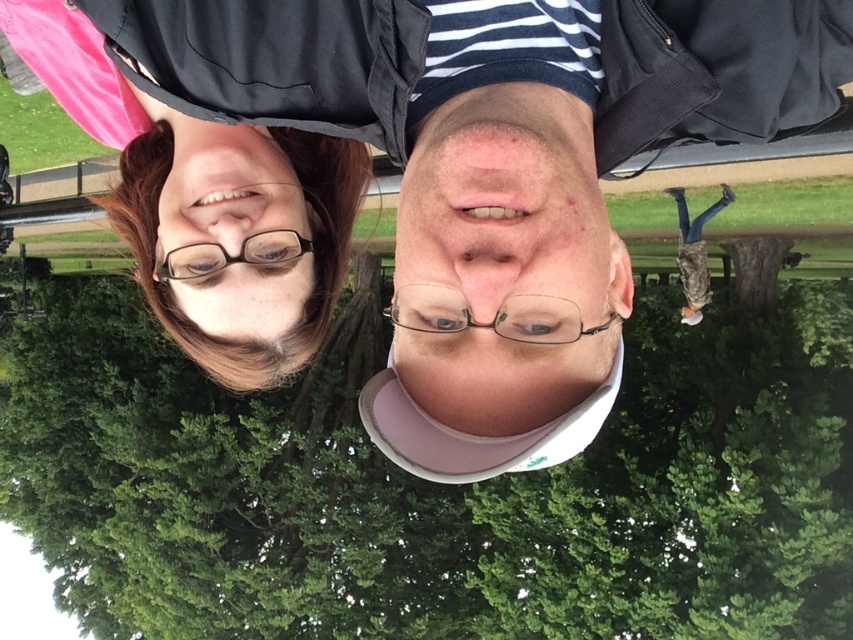
Is smooth skin face at center below clear plastic glasses at upper center?

Indeed, smooth skin face at center is positioned under clear plastic glasses at upper center.

Measure the distance from smooth skin face at center to clear plastic glasses at upper center.

The distance of smooth skin face at center from clear plastic glasses at upper center is 32.20 inches.

You are a GUI agent. You are given a task and a screenshot of the screen. Output one action in this format:
    pyautogui.click(x=<x>, y=<y>)
    Task: Click on the smooth skin face at center
    The image size is (853, 640).
    Given the screenshot: What is the action you would take?
    pyautogui.click(x=506, y=266)

Where is `smooth skin face at center`? The height and width of the screenshot is (640, 853). smooth skin face at center is located at coordinates (506, 266).

From the picture: Is green leafy tree at center below clear plastic glasses at upper center?

Correct, green leafy tree at center is located below clear plastic glasses at upper center.

Measure the distance between point (643, 372) and camera.

Point (643, 372) is 18.20 meters from camera.

Which is in front, point (817, 564) or point (265, 259)?

Point (265, 259) is in front.

You are a GUI agent. You are given a task and a screenshot of the screen. Output one action in this format:
    pyautogui.click(x=<x>, y=<y>)
    Task: Click on the green leafy tree at center
    Image resolution: width=853 pixels, height=640 pixels.
    Given the screenshot: What is the action you would take?
    pyautogui.click(x=437, y=492)

Consider the image. Does smooth skin face at center appear over matte black glasses at upper left?

Incorrect, smooth skin face at center is not positioned above matte black glasses at upper left.

Image resolution: width=853 pixels, height=640 pixels. What do you see at coordinates (506, 266) in the screenshot?
I see `smooth skin face at center` at bounding box center [506, 266].

The width and height of the screenshot is (853, 640). Describe the element at coordinates (506, 266) in the screenshot. I see `smooth skin face at center` at that location.

The width and height of the screenshot is (853, 640). Identify the location of smooth skin face at center. pos(506,266).